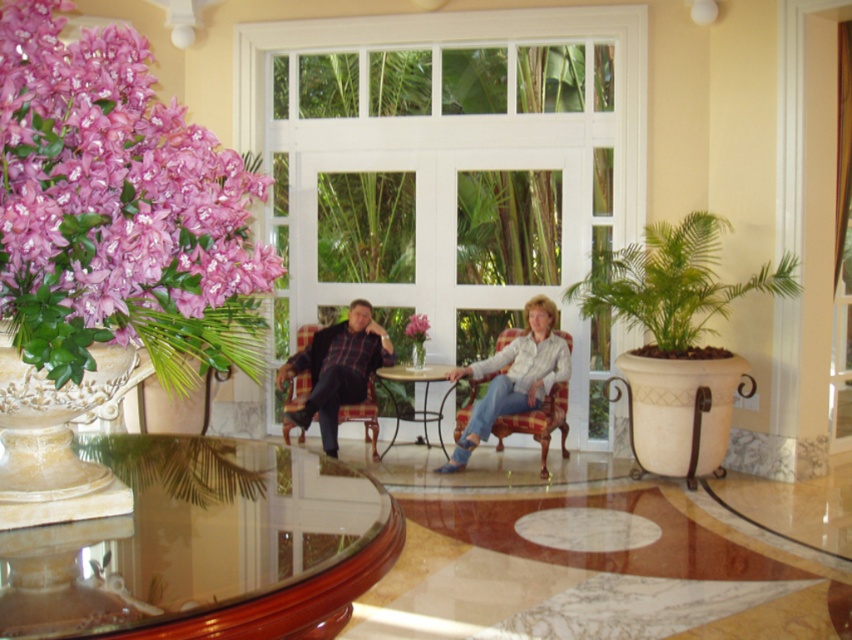
Can you confirm if plaid fabric chair at center is positioned to the left of wooden round table at center?

Yes, plaid fabric chair at center is to the left of wooden round table at center.

Does plaid fabric chair at center come behind wooden round table at center?

No.

Find the location of `plaid fabric chair at center`. plaid fabric chair at center is located at coordinates (338, 369).

Between matte plaid shirt at center and pink matte flower at center, which one appears on the right side from the viewer's perspective?

pink matte flower at center

Which is in front, point (337, 376) or point (418, 316)?

Point (337, 376)

Who is more distant from viewer, (366,301) or (422,317)?

The point (422,317) is more distant.

Locate an element on the screen. The image size is (852, 640). matte plaid shirt at center is located at coordinates (338, 369).

Between pink silk flowers at left and matte plaid shirt at center, which one appears on the right side from the viewer's perspective?

Positioned to the right is matte plaid shirt at center.

Is pink silk flowers at left positioned in front of matte plaid shirt at center?

Yes.

Who is more forward, (x=43, y=236) or (x=315, y=390)?

Point (x=43, y=236) is in front.

Find the location of a particular element. The image size is (852, 640). pink silk flowers at left is located at coordinates (110, 186).